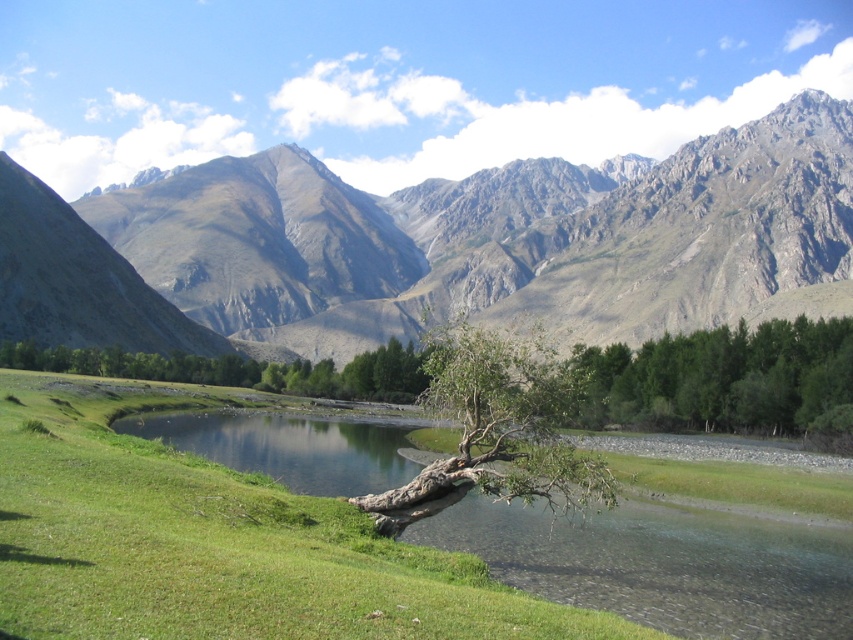
You are standing at the point marked as point (554, 404) and want to reach the riverbank. The river is flowing towards the southeast. If you walk directly towards the riverbank, will you be moving in the same direction as the river flows?

Yes, because the river flows towards the southeast, and walking directly towards the riverbank from point (554, 404) would also be in the southeast direction.

You are standing on the riverbank and want to take a photo of the brown textured tree at center and the green leafy trees at lower right. Which tree group should you focus on first if you want to capture both in the same frame without moving your camera?

The brown textured tree at center is shorter than green leafy trees at lower right, so you should focus on the green leafy trees at lower right first as they are taller and might require adjusting the camera angle to include both in the frame.